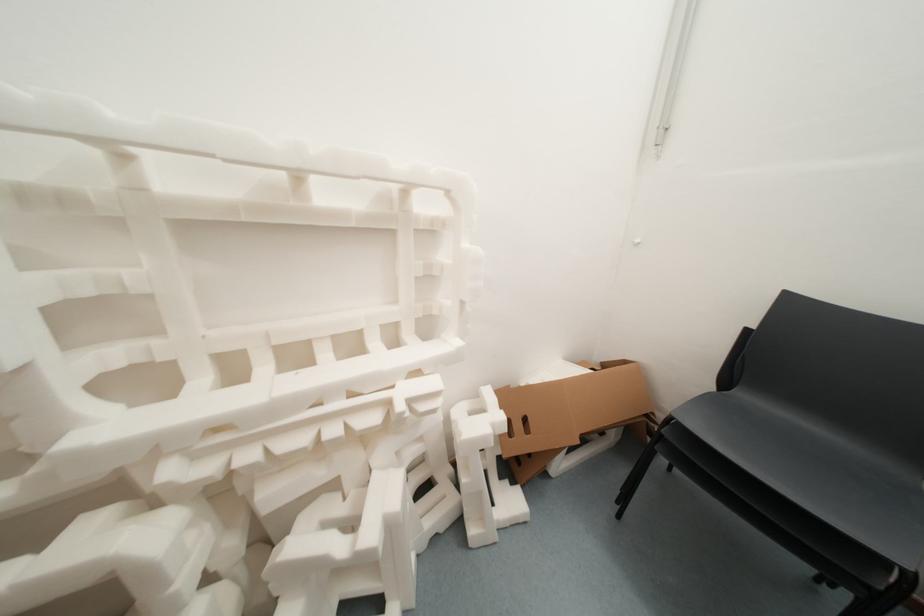
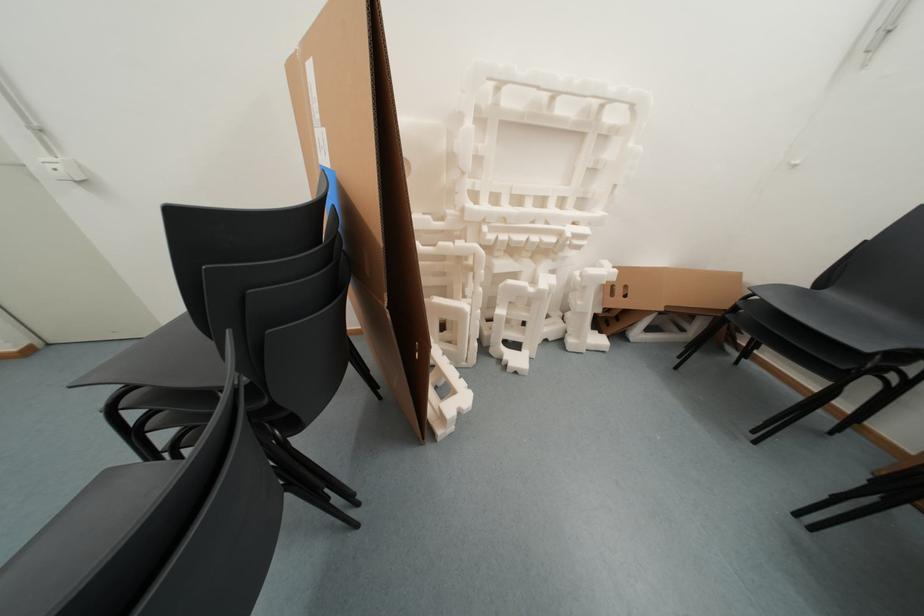
Question: Which direction would the cameraman need to move to produce the second image? Reply with the corresponding letter.

Choices:
 (A) Left
 (B) Right
 (C) Forward
 (D) Backward

Answer: (D)